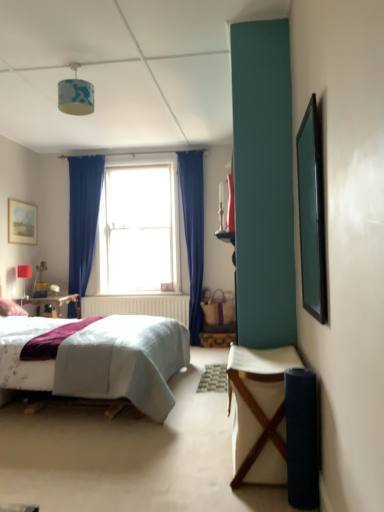
The height and width of the screenshot is (512, 384). Find the location of `free spot above blue fabric lampshade at upper center, the first lamp when ordered from right to left (from a real-world perspective)`. free spot above blue fabric lampshade at upper center, the first lamp when ordered from right to left (from a real-world perspective) is located at coordinates (73, 66).